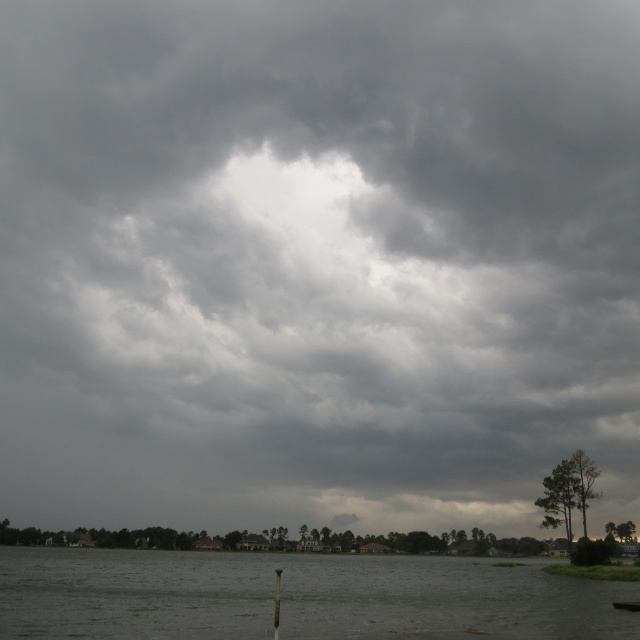
You are standing on a dock near the gray matte water at lower center and want to reach the dark gray metallic boat at lower right. Which direction should you move to get closer to the boat?

You should move towards the lower right direction to get closer to the dark gray metallic boat at lower right since the gray matte water at lower center is below it.

You are an observer standing on the dock and looking at the gray matte water at lower center and the dark gray metallic boat at lower right. Which object covers a larger area in the image?

The gray matte water at lower center covers a larger area in the image than the dark gray metallic boat at lower right because it is bigger according to the description.

You are planning to dock your dark gray metallic boat at lower right on the gray matte water at lower center. Considering the width of the water, will there be enough space for the boat to maneuver comfortably?

The gray matte water at lower center has a larger width than the dark gray metallic boat at lower right, so there should be enough space for the boat to maneuver comfortably.